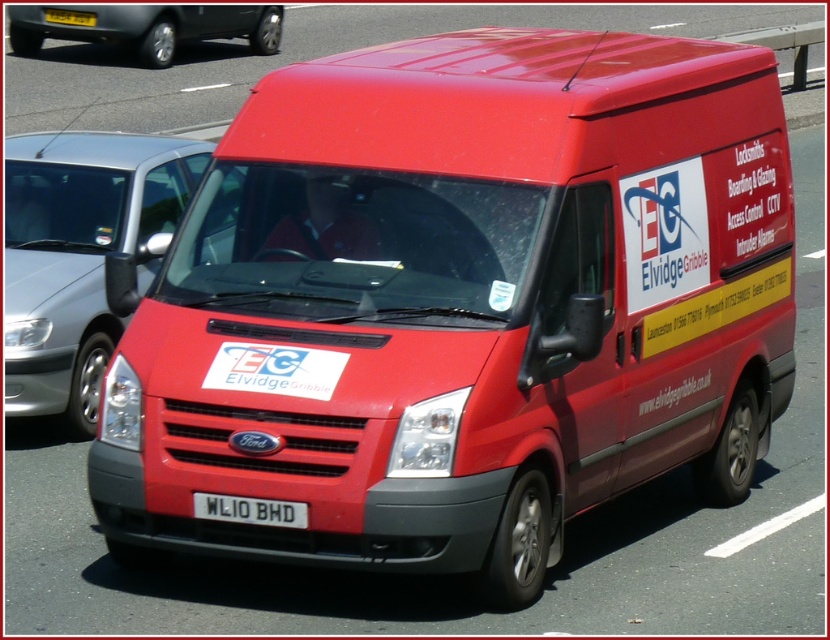
You are standing at the center of the scene and want to move towards the metallic gray car at upper left. Which direction should you move in?

The metallic gray car at upper left is located at point coordinates that are to the upper left relative to your position at the center, so you should move towards the upper left direction to reach it.